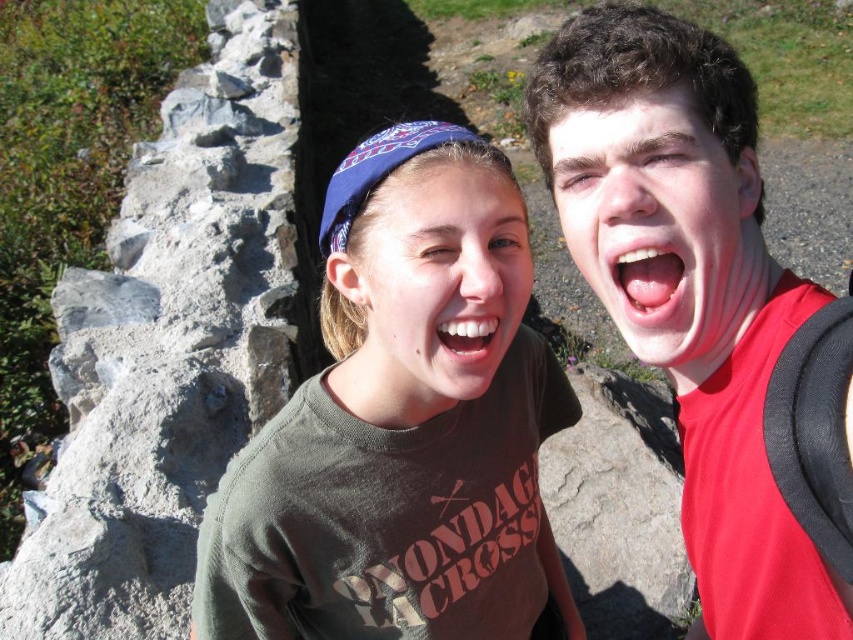
You are a photographer standing 2 meters away from the matte skin face at center. You want to take a closeup shot of it. Do you think you need to move closer or farther away?

The matte skin face at center is 1.47 meters away from the camera. Since you are currently 2 meters away, you need to move closer to get a closeup shot.